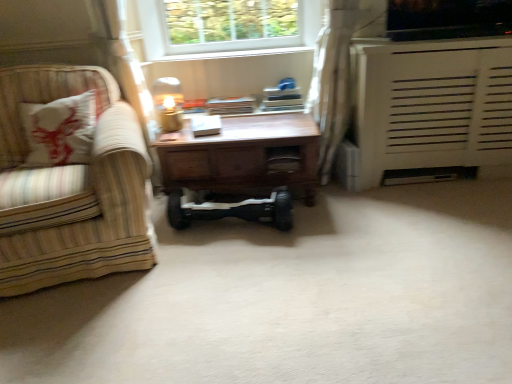
Question: Is matte gold table lamp at center positioned behind white matte radiator at right?

Choices:
 (A) yes
 (B) no

Answer: (A)

Question: Is matte gold table lamp at center touching white matte radiator at right?

Choices:
 (A) yes
 (B) no

Answer: (B)

Question: Is white matte radiator at right a part of matte gold table lamp at center?

Choices:
 (A) yes
 (B) no

Answer: (B)

Question: Would you consider matte gold table lamp at center to be distant from white matte radiator at right?

Choices:
 (A) yes
 (B) no

Answer: (A)

Question: Does matte gold table lamp at center have a greater height compared to white matte radiator at right?

Choices:
 (A) yes
 (B) no

Answer: (B)

Question: Considering the positions of white sheer curtain at upper right and black rubber hoverboard at center in the image, is white sheer curtain at upper right bigger or smaller than black rubber hoverboard at center?

Choices:
 (A) small
 (B) big

Answer: (B)

Question: Do you think white sheer curtain at upper right is within black rubber hoverboard at center, or outside of it?

Choices:
 (A) inside
 (B) outside

Answer: (B)

Question: From the image's perspective, is white sheer curtain at upper right positioned above or below black rubber hoverboard at center?

Choices:
 (A) above
 (B) below

Answer: (A)

Question: Does point (336, 99) appear closer or farther from the camera than point (173, 190)?

Choices:
 (A) closer
 (B) farther

Answer: (B)

Question: Do you think white sheer curtain at upper right is within white matte radiator at right, or outside of it?

Choices:
 (A) outside
 (B) inside

Answer: (B)

Question: Considering the positions of point (324, 119) and point (411, 77), is point (324, 119) closer or farther from the camera than point (411, 77)?

Choices:
 (A) farther
 (B) closer

Answer: (A)

Question: Is white sheer curtain at upper right to the left or to the right of white matte radiator at right in the image?

Choices:
 (A) right
 (B) left

Answer: (B)

Question: From a real-world perspective, relative to white matte radiator at right, is white sheer curtain at upper right vertically above or below?

Choices:
 (A) below
 (B) above

Answer: (B)

Question: Is wooden desk at center bigger or smaller than matte gold table lamp at center?

Choices:
 (A) big
 (B) small

Answer: (A)

Question: Is wooden desk at center situated inside matte gold table lamp at center or outside?

Choices:
 (A) inside
 (B) outside

Answer: (B)